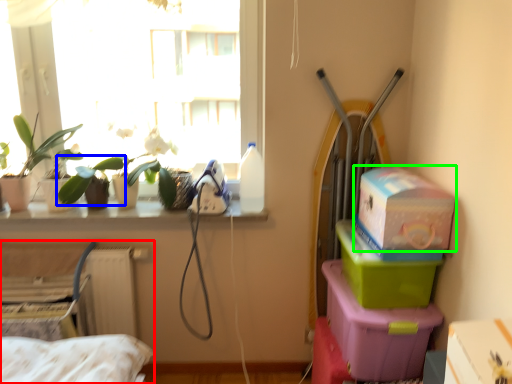
Question: Which is farther away from bed (highlighted by a red box)? plant (highlighted by a blue box) or box (highlighted by a green box)?

Choices:
 (A) plant
 (B) box

Answer: (B)